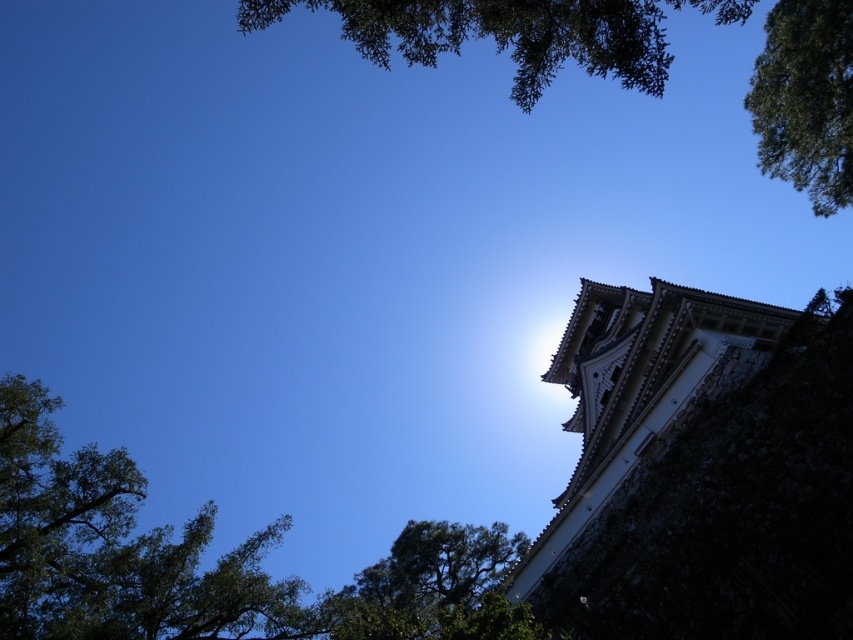
Question: Considering the relative positions of green leafy tree at upper center and green leafy tree at lower center in the image provided, where is green leafy tree at upper center located with respect to green leafy tree at lower center?

Choices:
 (A) above
 (B) below

Answer: (A)

Question: Which point is closer to the camera taking this photo?

Choices:
 (A) (123, 588)
 (B) (831, 388)

Answer: (B)

Question: Does white stone tower at upper right lie in front of green leafy tree at upper center?

Choices:
 (A) yes
 (B) no

Answer: (A)

Question: Which point is closer to the camera taking this photo?

Choices:
 (A) (801, 61)
 (B) (827, 170)
 (C) (412, 605)

Answer: (A)

Question: Is white stone tower at upper right to the left of green leafy tree at upper center from the viewer's perspective?

Choices:
 (A) no
 (B) yes

Answer: (A)

Question: Which is farther from the white stone tower at upper right?

Choices:
 (A) green leafy tree at lower center
 (B) green leafy tree at upper center
 (C) green leafy tree at lower left
 (D) green leafy tree at upper right

Answer: (C)